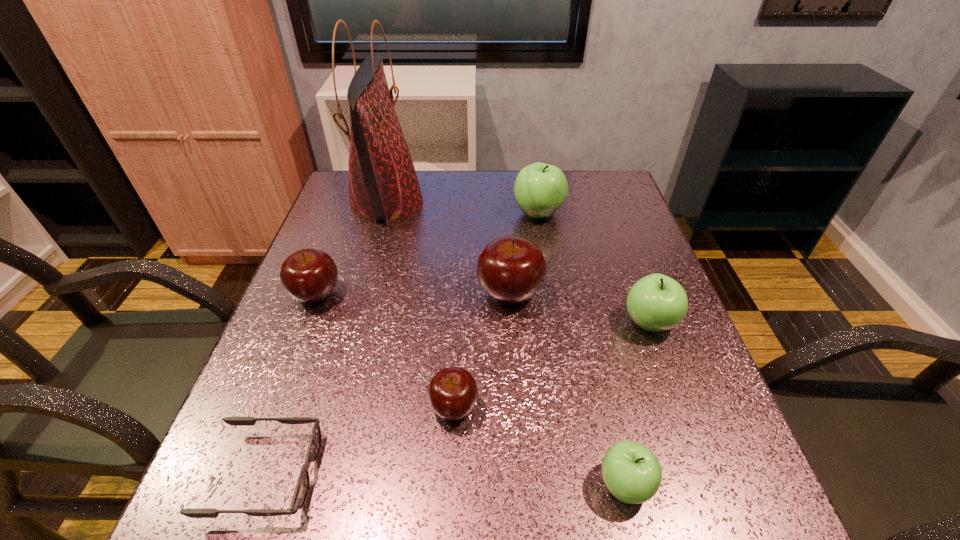
I want to click on free space located on the temples of the sunglasses, so click(508, 474).

Identify the location of handbag that is at the far edge. Image resolution: width=960 pixels, height=540 pixels. (383, 185).

Locate an element on the screen. apple present at the far edge is located at coordinates (540, 189).

Where is `apple at the near edge`? The height and width of the screenshot is (540, 960). apple at the near edge is located at coordinates (632, 473).

Locate an element on the screen. This screenshot has width=960, height=540. sunglasses that is at the near edge is located at coordinates (301, 490).

Where is `handbag situated at the left edge`? The width and height of the screenshot is (960, 540). handbag situated at the left edge is located at coordinates (383, 185).

Locate an element on the screen. apple that is positioned at the left edge is located at coordinates (309, 275).

Identify the location of sunglasses present at the left edge. (301, 490).

Locate an element on the screen. The image size is (960, 540). object at the far left corner is located at coordinates point(383,185).

This screenshot has height=540, width=960. I want to click on object at the near left corner, so point(301,490).